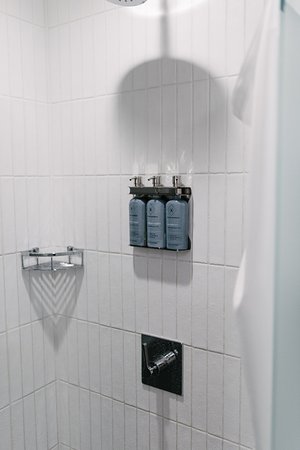
Locate an element on the screen. The height and width of the screenshot is (450, 300). shower corner shelf is located at coordinates (55, 264).